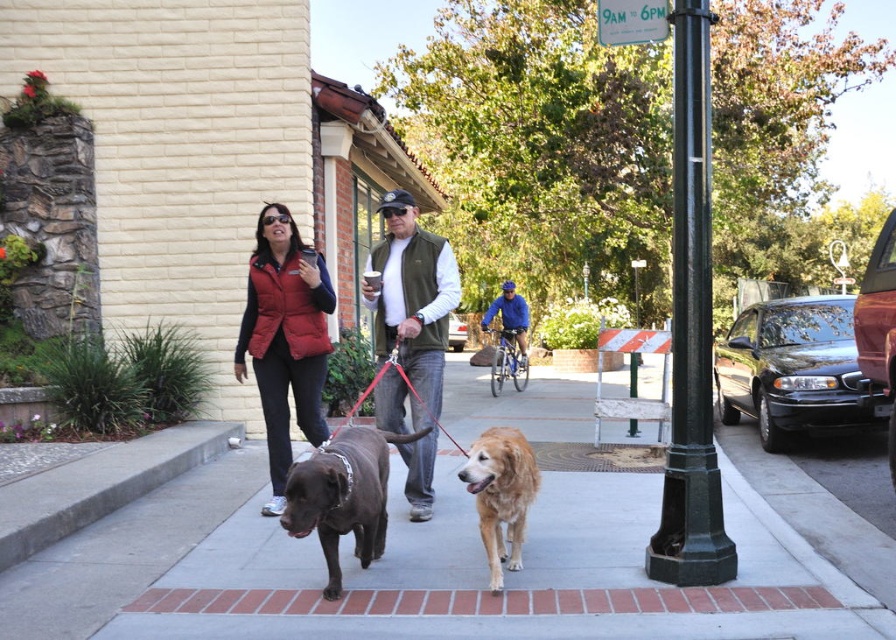
You are a delivery person who needs to deliver a package to the blue fabric helmet at center. The golden matte dog at center is blocking the path. Can you move around the dog to reach the helmet?

The golden matte dog at center is positioned on the left side of blue fabric helmet at center, so you can move around the dog to the right side to reach the helmet.

You are a delivery person who needs to quickly pass by the two dogs on the sidewalk. The golden matte dog at center and the blue fabric helmet at center are in your path. Considering their heights, which one might you need to step over?

The golden matte dog at center is shorter than the blue fabric helmet at center, so you would need to step over the blue fabric helmet at center since it is taller.